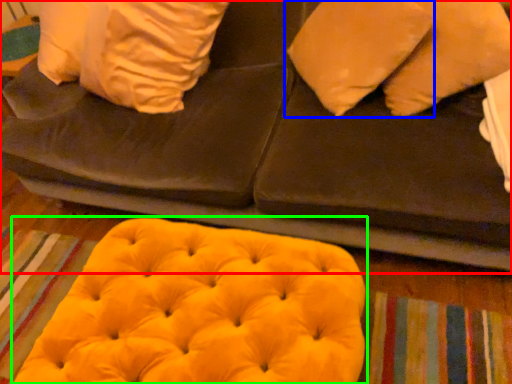
Question: Estimate the real-world distances between objects in this image. Which object is closer to furniture (highlighted by a red box), pillow (highlighted by a blue box) or bean bag chair (highlighted by a green box)?

Choices:
 (A) pillow
 (B) bean bag chair

Answer: (A)